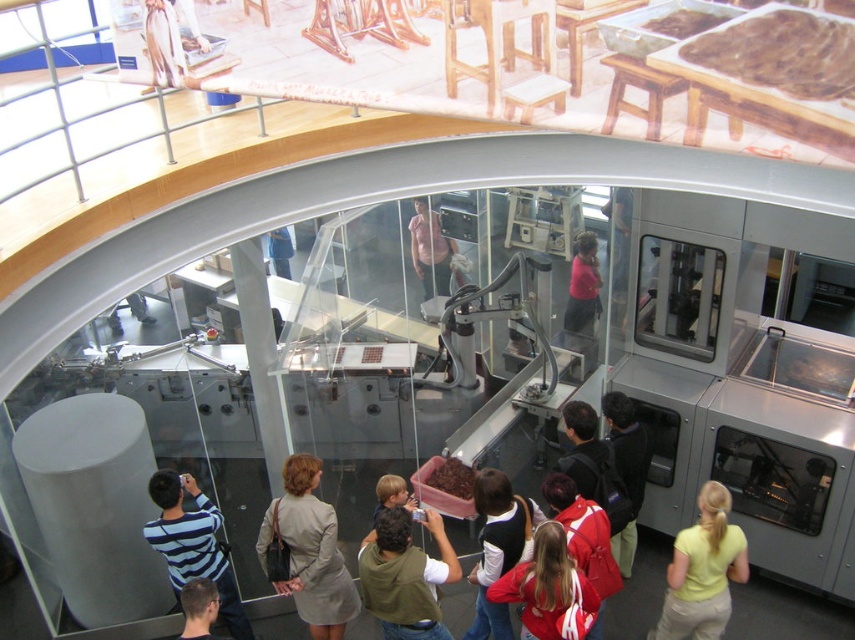
Locate an element on the screen. This screenshot has height=640, width=855. green fabric hoodie at center is located at coordinates (405, 576).

Who is taller, green fabric hoodie at center or dark blue backpack at lower right?

Standing taller between the two is dark blue backpack at lower right.

Does point (443, 528) lie behind point (635, 436)?

Yes.

Locate an element on the screen. The width and height of the screenshot is (855, 640). green fabric hoodie at center is located at coordinates (405, 576).

Is point (304, 605) closer to camera compared to point (575, 243)?

Yes, it is.

Locate an element on the screen. This screenshot has width=855, height=640. light beige fabric coat at center is located at coordinates (310, 550).

Can you confirm if black sweater at center is shorter than dark blue backpack at lower right?

Yes.

Which is in front, point (488, 512) or point (612, 442)?

Point (488, 512)

Locate an element on the screen. The width and height of the screenshot is (855, 640). black sweater at center is located at coordinates (498, 547).